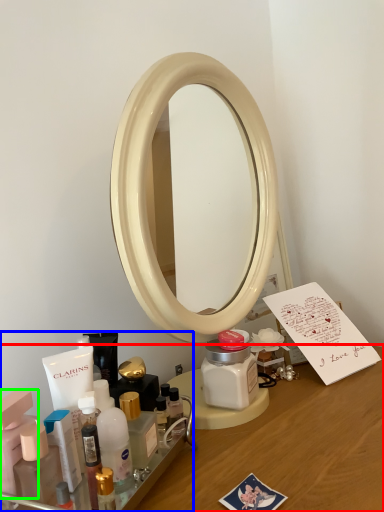
Question: Which object is positioned farthest from desk (highlighted by a red box)? Select from toiletry (highlighted by a blue box) and toiletry (highlighted by a green box).

Choices:
 (A) toiletry
 (B) toiletry

Answer: (B)